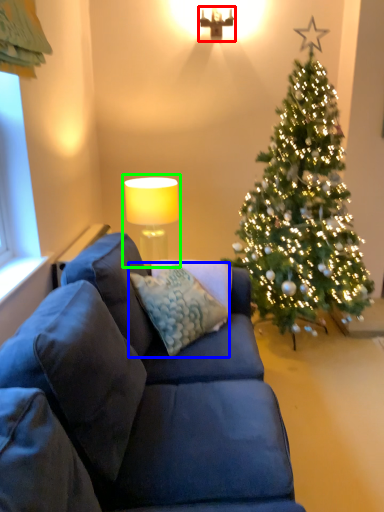
Question: Estimate the real-world distances between objects in this image. Which object is farther from lamp (highlighted by a red box), pillow (highlighted by a blue box) or table lamp (highlighted by a green box)?

Choices:
 (A) pillow
 (B) table lamp

Answer: (A)